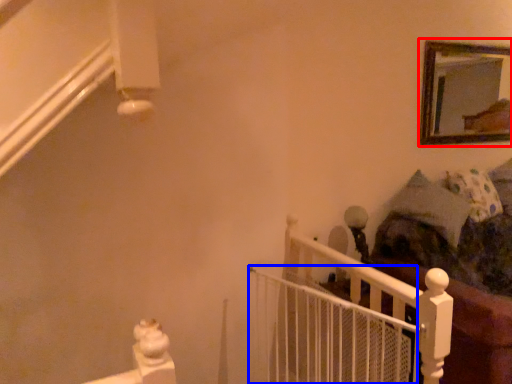
Question: Which of the following is the farthest to the observer, picture frame (highlighted by a red box) or balustrade (highlighted by a blue box)?

Choices:
 (A) picture frame
 (B) balustrade

Answer: (A)